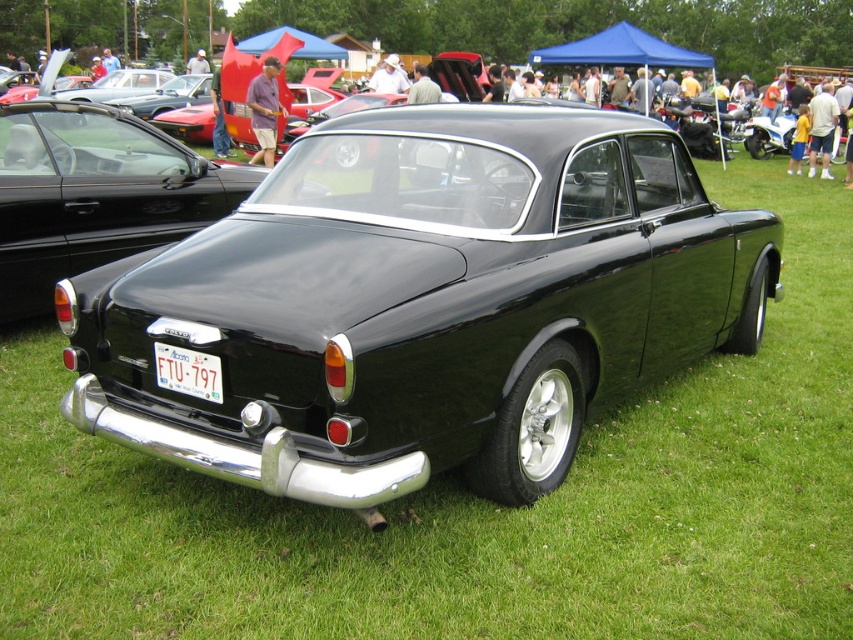
Between black glossy car at center and white plastic license plate at center, which one is positioned higher?

black glossy car at center is higher up.

Can you confirm if black glossy car at center is positioned above white plastic license plate at center?

Indeed, black glossy car at center is positioned over white plastic license plate at center.

I want to click on black glossy car at center, so click(x=96, y=195).

At what (x,y) coordinates should I click in order to perform the action: click on black glossy car at center. Please return your answer as a coordinate pair (x, y). The image size is (853, 640). Looking at the image, I should click on (96, 195).